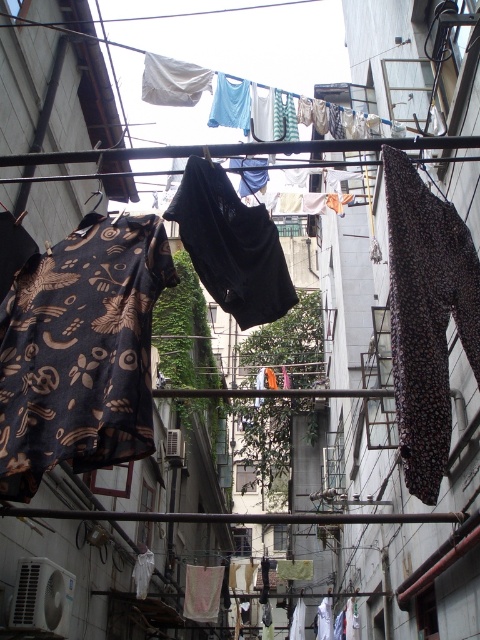
Is brown printed fabric shirt at left smaller than brown dotted fabric at right?

Incorrect, brown printed fabric shirt at left is not smaller in size than brown dotted fabric at right.

Does brown printed fabric shirt at left lie behind brown dotted fabric at right?

Yes, it is.

Find the location of a particular element. The image size is (480, 640). brown printed fabric shirt at left is located at coordinates (x=81, y=352).